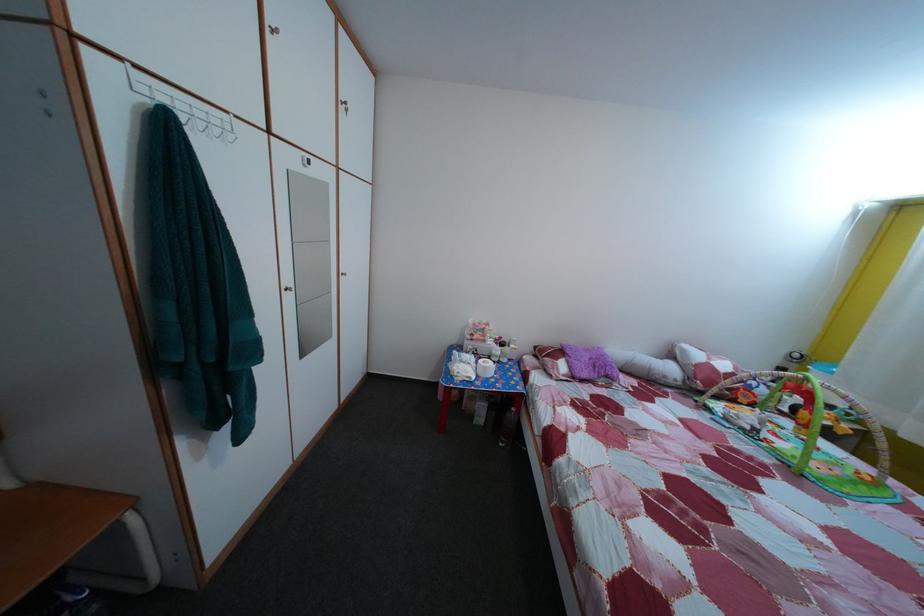
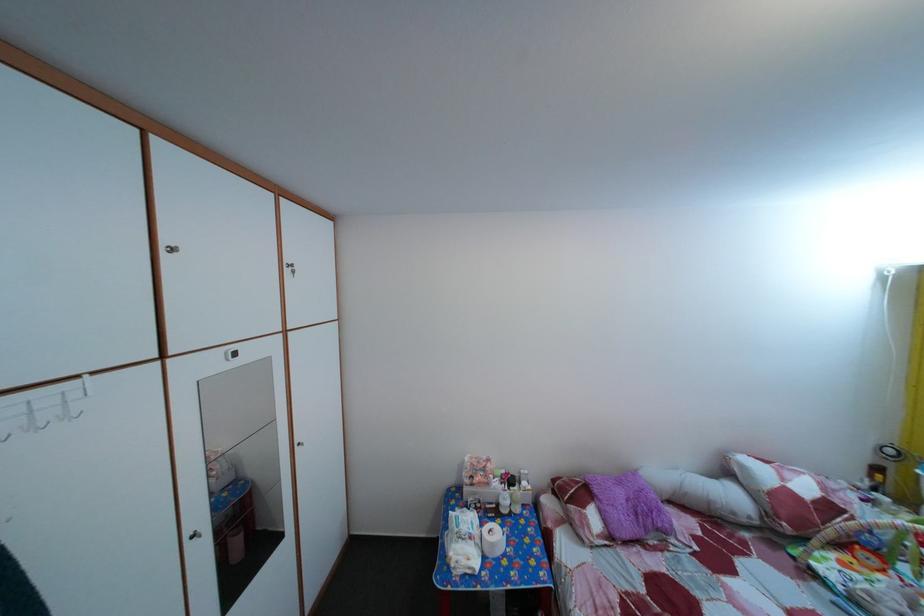
The point at (514, 350) is marked in the first image. Where is the corresponding point in the second image?

(524, 485)